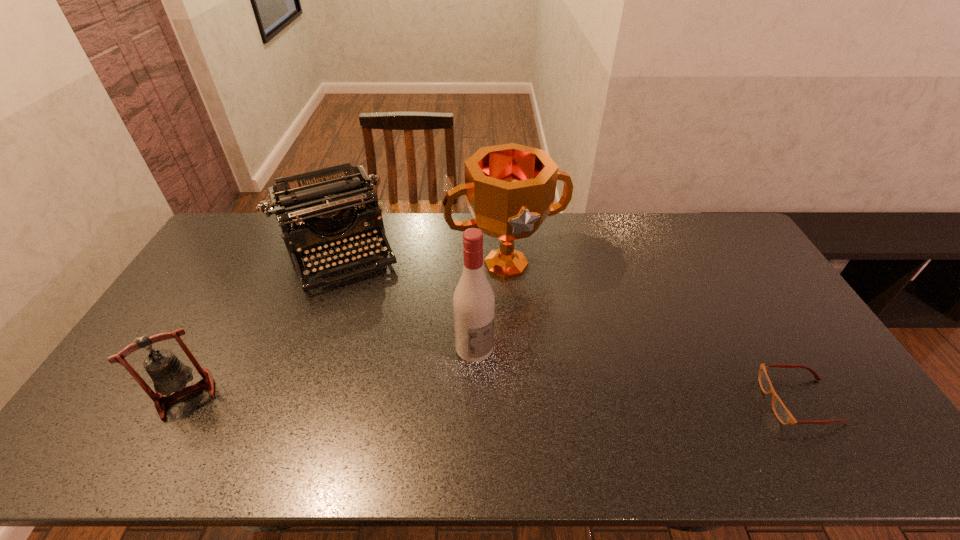
Find the location of a particular element. The width and height of the screenshot is (960, 540). free space on the desktop that is between the bell and the shortest object and is positioned on the typing side of the typewriter is located at coordinates (399, 397).

You are a GUI agent. You are given a task and a screenshot of the screen. Output one action in this format:
    pyautogui.click(x=<x>, y=<y>)
    Task: Click on the vacant space on the desktop that is between the bell and the shortest object and is positioned on the side of the award with the star emblem
    Image resolution: width=960 pixels, height=540 pixels.
    Given the screenshot: What is the action you would take?
    pyautogui.click(x=575, y=399)

I want to click on free space on the desktop that is between the bell and the rightmost object and is positioned on the label of the alcohol, so click(520, 398).